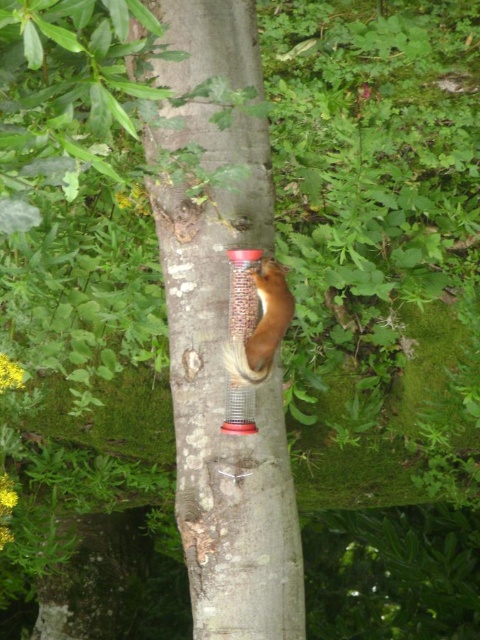
Question: Which point appears closest to the camera in this image?

Choices:
 (A) (240, 257)
 (B) (297, 568)
 (C) (273, 317)

Answer: (C)

Question: Which point is closer to the camera taking this photo?

Choices:
 (A) (257, 634)
 (B) (264, 358)
 (C) (239, 420)

Answer: (B)

Question: Observing the image, what is the correct spatial positioning of golden-brown fur squirrel at center in reference to transparent plastic bird feeder at center?

Choices:
 (A) right
 (B) left

Answer: (A)

Question: Does smooth bark tree trunk at center appear under transparent plastic bird feeder at center?

Choices:
 (A) yes
 (B) no

Answer: (B)

Question: Is golden-brown fur squirrel at center to the left of transparent plastic bird feeder at center from the viewer's perspective?

Choices:
 (A) yes
 (B) no

Answer: (B)

Question: Among these points, which one is farthest from the camera?

Choices:
 (A) pos(285,298)
 (B) pos(195,282)
 (C) pos(242,404)

Answer: (B)